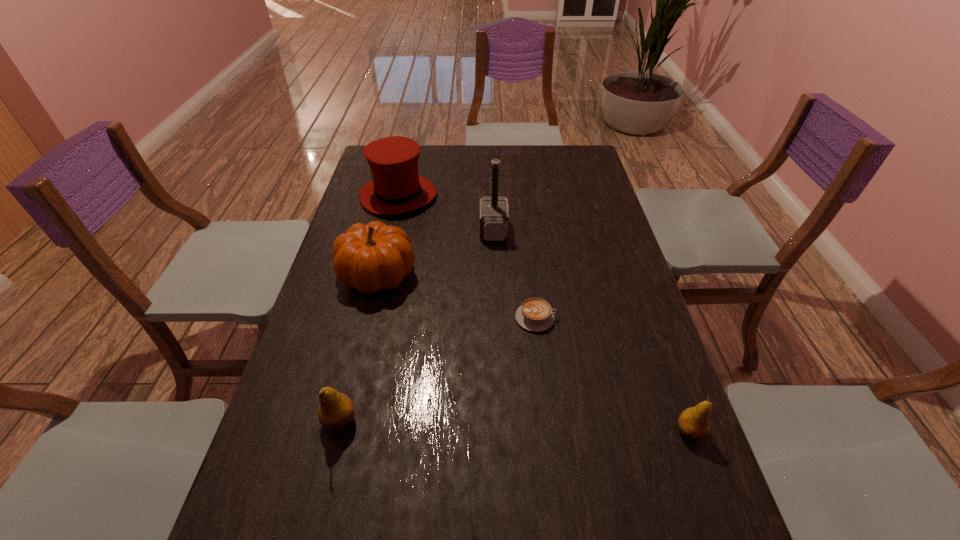
Identify the location of vacant space that satisfies the following two spatial constraints: 1. on the side of the second object from right to left with the handle; 2. on the left side of the shorter pear. (549, 431).

Where is `free space in the image that satisfies the following two spatial constraints: 1. for striking with the head of the tallest object; 2. on the front side of the fourth nearest object`? free space in the image that satisfies the following two spatial constraints: 1. for striking with the head of the tallest object; 2. on the front side of the fourth nearest object is located at coordinates (495, 274).

The width and height of the screenshot is (960, 540). In order to click on vacant space that satisfies the following two spatial constraints: 1. on the side of the fourth farthest object with the handle; 2. on the front side of the taller pear in this screenshot , I will do `click(548, 421)`.

The width and height of the screenshot is (960, 540). I want to click on free location that satisfies the following two spatial constraints: 1. for striking with the head of the tallest object; 2. on the front side of the pumpkin, so coord(495,274).

Locate an element on the screen. vacant area that satisfies the following two spatial constraints: 1. on the side of the fifth object from left to right with the handle; 2. on the right side of the right pear is located at coordinates (549, 431).